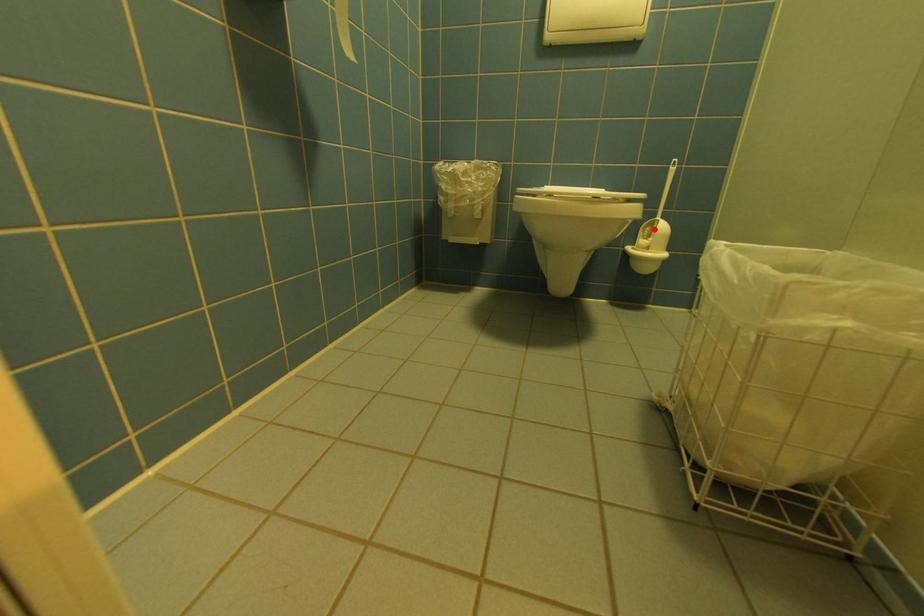
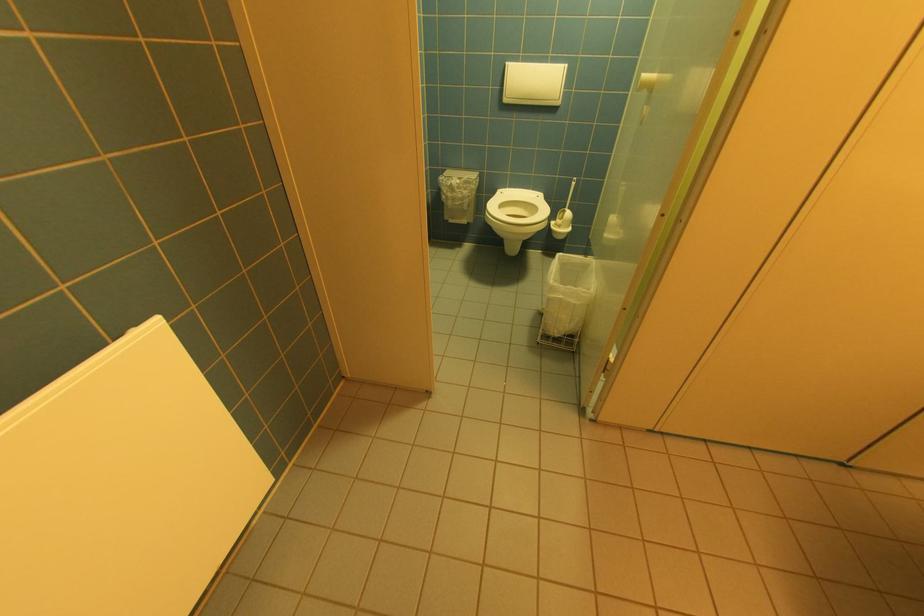
In the second image, find the point that corresponds to the highlighted location in the first image.

(567, 215)